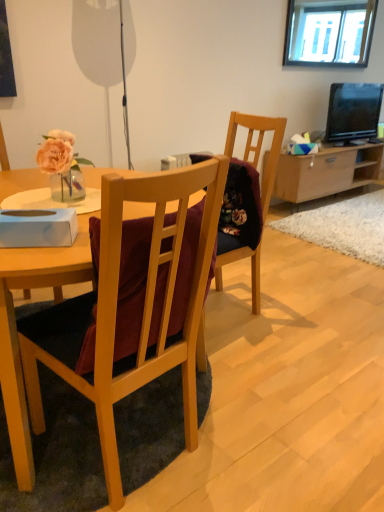
Where is `vacant region to the right of wooden chair at center`? This screenshot has height=512, width=384. vacant region to the right of wooden chair at center is located at coordinates click(301, 318).